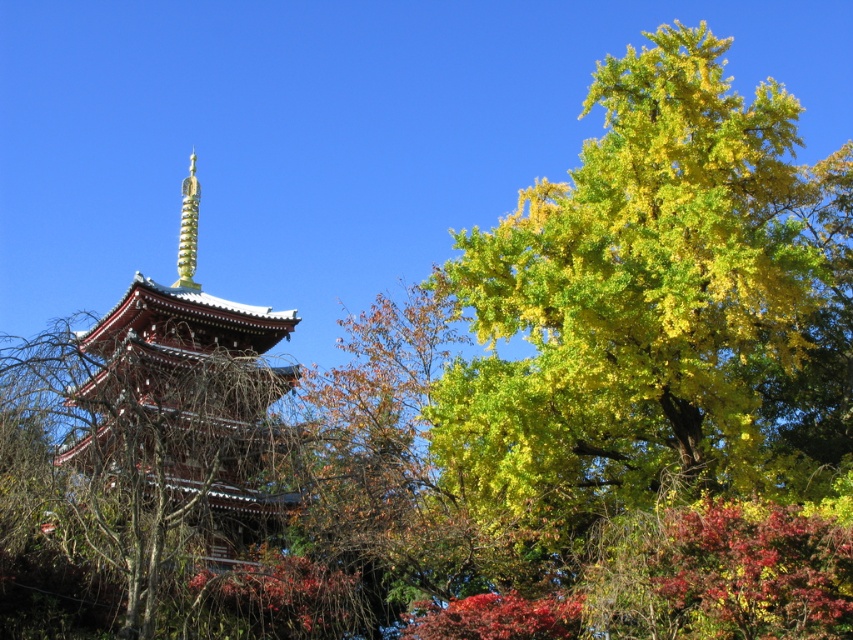
You are standing in front of the pagoda and want to determine which of the two points, point (187, 344) or point (183, 234), is nearer to you. Based on the scene, which point is closer?

Point (187, 344) is closer to the viewer than point (183, 234).

You are standing at the camera position and want to take a photo of the matte red pagoda at center. If your camera has a maximum focus range of 150 feet, will you be able to capture the pagoda clearly?

The matte red pagoda at center and camera are 170.42 feet apart from each other. Since the distance exceeds the camera maximum focus range of 150 feet, you will not be able to capture the pagoda clearly.

You are an architect examining the pagoda structure. You notice the matte red pagoda at center and the gold textured spire at upper center. Based on their positions, which one is located to the right of the other?

The matte red pagoda at center is positioned on the right side of gold textured spire at upper center, so the matte red pagoda at center is to the right of the gold textured spire at upper center.